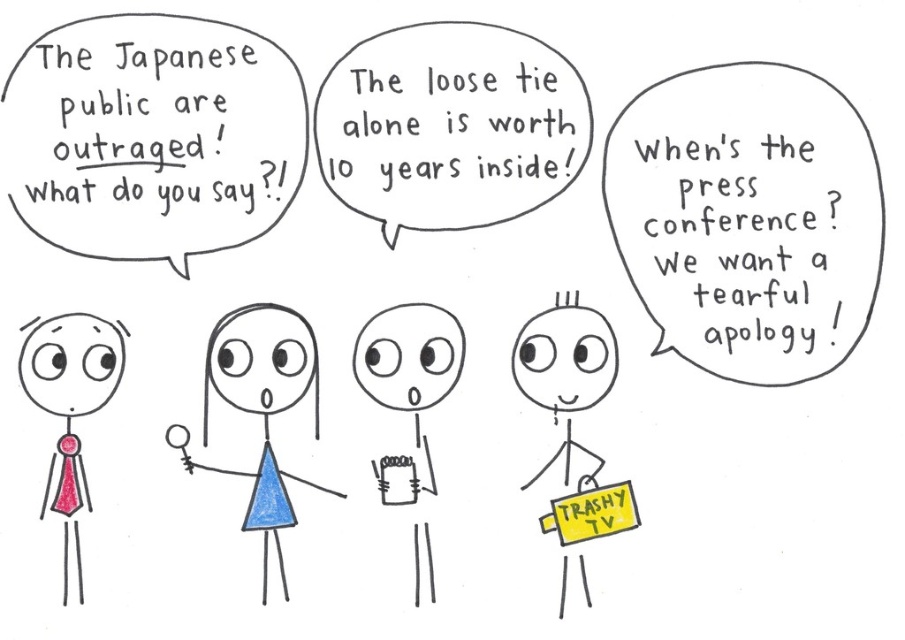
Is blue paper doll at center shorter than blue paper at center?

Yes.

Does blue paper doll at center appear on the right side of blue paper at center?

No, blue paper doll at center is not to the right of blue paper at center.

Does point (286, 307) come behind point (435, 314)?

No, (286, 307) is closer to viewer.

Locate an element on the screen. blue paper doll at center is located at coordinates (260, 404).

Between blue paper at center and matte pink tie at left, which one appears on the left side from the viewer's perspective?

matte pink tie at left

Is blue paper at center wider than matte pink tie at left?

Yes.

The height and width of the screenshot is (640, 905). Describe the element at coordinates (408, 385) in the screenshot. I see `blue paper at center` at that location.

Identify the location of blue paper at center. The height and width of the screenshot is (640, 905). (408, 385).

Which is behind, point (534, 365) or point (386, 484)?

The point (534, 365) is behind.

Can you confirm if yellow paper sign at lower right is thinner than blue paper at center?

No, yellow paper sign at lower right is not thinner than blue paper at center.

Who is more forward, (x=563, y=579) or (x=386, y=396)?

Point (x=563, y=579)

You are a GUI agent. You are given a task and a screenshot of the screen. Output one action in this format:
    pyautogui.click(x=<x>, y=<y>)
    Task: Click on the yellow paper sign at lower right
    The image size is (905, 640).
    Given the screenshot: What is the action you would take?
    pyautogui.click(x=565, y=356)